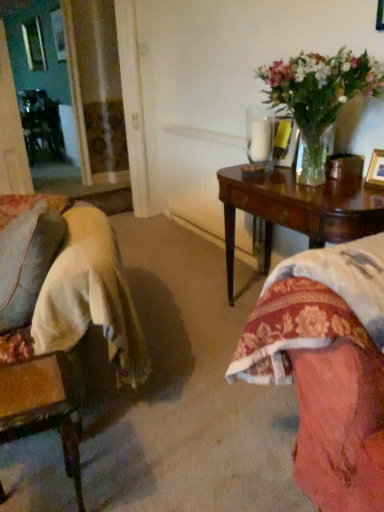
The height and width of the screenshot is (512, 384). I want to click on wooden picture frame at upper right, so click(376, 169).

This screenshot has height=512, width=384. What do you see at coordinates (59, 316) in the screenshot?
I see `velvet beige chair at left` at bounding box center [59, 316].

You are a GUI agent. You are given a task and a screenshot of the screen. Output one action in this format:
    pyautogui.click(x=<x>, y=<y>)
    Task: Click on the wooden picture frame at upper right
    
    Given the screenshot: What is the action you would take?
    pyautogui.click(x=376, y=169)

Do you think wooden swivel chair at lower left is within clear glass vase at upper right, or outside of it?

wooden swivel chair at lower left is outside clear glass vase at upper right.

How many degrees apart are the facing directions of wooden swivel chair at lower left and clear glass vase at upper right?

The facing directions of wooden swivel chair at lower left and clear glass vase at upper right are 53.2 degrees apart.

Considering the sizes of wooden swivel chair at lower left and clear glass vase at upper right in the image, is wooden swivel chair at lower left wider or thinner than clear glass vase at upper right?

In the image, wooden swivel chair at lower left appears to be wider than clear glass vase at upper right.

Which is in front, wooden swivel chair at lower left or clear glass vase at upper right?

wooden swivel chair at lower left is in front.

Considering the sizes of objects clear glass vase at upper right and wooden swivel chair at lower left in the image provided, who is taller, clear glass vase at upper right or wooden swivel chair at lower left?

wooden swivel chair at lower left is taller.

Between point (315, 178) and point (3, 490), which one is positioned behind?

Positioned behind is point (315, 178).

Is there a large distance between clear glass vase at upper right and wooden swivel chair at lower left?

Yes, clear glass vase at upper right and wooden swivel chair at lower left are quite far apart.

The width and height of the screenshot is (384, 512). I want to click on vase above the wooden swivel chair at lower left (from a real-world perspective), so click(x=314, y=158).

Considering the relative positions of clear glass vase at upper right and mahogany wood table at right in the image provided, is clear glass vase at upper right to the left or to the right of mahogany wood table at right?

Based on their positions, clear glass vase at upper right is located to the left of mahogany wood table at right.

Are clear glass vase at upper right and mahogany wood table at right making contact?

No, clear glass vase at upper right is not making contact with mahogany wood table at right.

Is clear glass vase at upper right facing towards mahogany wood table at right?

No, clear glass vase at upper right does not turn towards mahogany wood table at right.

Is velvet beige chair at left aimed at white textured radiator at center?

No, velvet beige chair at left is not turned towards white textured radiator at center.

Measure the distance from velvet beige chair at left to white textured radiator at center.

velvet beige chair at left is 1.47 meters away from white textured radiator at center.

Considering the relative positions of velvet beige chair at left and white textured radiator at center in the image provided, is velvet beige chair at left to the left of white textured radiator at center from the viewer's perspective?

Yes, velvet beige chair at left is to the left of white textured radiator at center.

Does velvet beige chair at left touch white textured radiator at center?

They are not placed beside each other.

From a real-world perspective, is white textured radiator at center positioned above or below mahogany wood table at right?

white textured radiator at center is situated higher than mahogany wood table at right in the real world.

From the image's perspective, which one is positioned higher, white textured radiator at center or mahogany wood table at right?

white textured radiator at center appears higher in the image.

Is white textured radiator at center facing towards mahogany wood table at right?

No, white textured radiator at center is not facing towards mahogany wood table at right.

In the scene shown: From a real-world perspective, is clear glass vase at upper right positioned under white textured radiator at center based on gravity?

No, from a real-world perspective, clear glass vase at upper right is not under white textured radiator at center.

Is clear glass vase at upper right far from white textured radiator at center?

Yes, clear glass vase at upper right and white textured radiator at center are quite far apart.

Who is taller, clear glass vase at upper right or white textured radiator at center?

white textured radiator at center.

Where is `vase that appears on the right of white textured radiator at center`? This screenshot has height=512, width=384. vase that appears on the right of white textured radiator at center is located at coordinates (314, 158).

Looking at their sizes, would you say clear glass vase at upper right is wider or thinner than white textured radiator at center?

In the image, clear glass vase at upper right appears to be wider than white textured radiator at center.

Is clear glass vase at upper right facing towards white textured radiator at center?

No, clear glass vase at upper right is not oriented towards white textured radiator at center.

Which is less distant, (333,88) or (214,151)?

The point (333,88) is more forward.

The width and height of the screenshot is (384, 512). Find the location of `swivel chair to the left of clear glass vase at upper right`. swivel chair to the left of clear glass vase at upper right is located at coordinates (45, 404).

Locate an element on the screen. Image resolution: width=384 pixels, height=512 pixels. swivel chair in front of the clear glass vase at upper right is located at coordinates (45, 404).

Looking at the image, which one is located closer to clear glass vase at upper right, velvet beige chair at left or wooden swivel chair at lower left?

Based on the image, velvet beige chair at left appears to be nearer to clear glass vase at upper right.

Based on the photo, looking at the image, which one is located closer to white textured radiator at center, clear glass vase at upper right or velvet beige chair at left?

clear glass vase at upper right.

From the image, which object appears to be nearer to clear glass vase at upper right, clear glass vase at upper right or wooden swivel chair at lower left?

clear glass vase at upper right is positioned closer to the anchor clear glass vase at upper right.

Looking at the image, which one is located further to wooden swivel chair at lower left, wooden picture frame at upper right or clear glass vase at upper right?

Based on the image, wooden picture frame at upper right appears to be further to wooden swivel chair at lower left.

From the picture: Based on their spatial positions, is velvet beige chair at left or mahogany wood table at right closer to clear glass vase at upper right?

mahogany wood table at right is positioned closer to the anchor clear glass vase at upper right.

Which object lies nearer to the anchor point wooden picture frame at upper right, velvet beige chair at left or wooden swivel chair at lower left?

Based on the image, velvet beige chair at left appears to be nearer to wooden picture frame at upper right.

Looking at this image, when comparing their distances from clear glass vase at upper right, does clear glass vase at upper right or white textured radiator at center seem further?

Among the two, white textured radiator at center is located further to clear glass vase at upper right.

Estimate the real-world distances between objects in this image. Which object is closer to white textured radiator at center, mahogany wood table at right or clear glass vase at upper right?

mahogany wood table at right is closer to white textured radiator at center.

Locate an element on the screen. vase located between wooden swivel chair at lower left and white textured radiator at center in the depth direction is located at coordinates (314, 158).

The width and height of the screenshot is (384, 512). Identify the location of swivel chair between velvet beige chair at left and wooden picture frame at upper right from left to right. (45, 404).

Locate an element on the screen. This screenshot has width=384, height=512. vase between clear glass vase at upper right and white textured radiator at center in the front-back direction is located at coordinates (314, 158).

Locate an element on the screen. Image resolution: width=384 pixels, height=512 pixels. picture frame between mahogany wood table at right and clear glass vase at upper right from front to back is located at coordinates (376, 169).